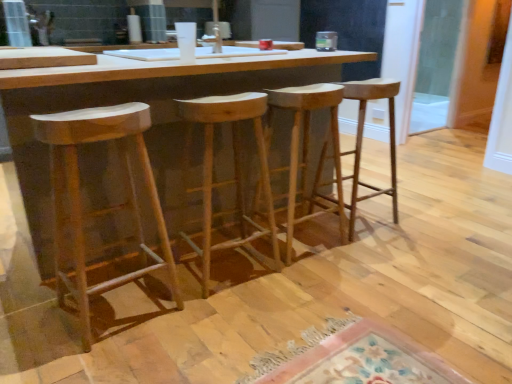
Find the location of a particular element. The image size is (512, 384). free space in front of transparent glass door at right is located at coordinates (440, 144).